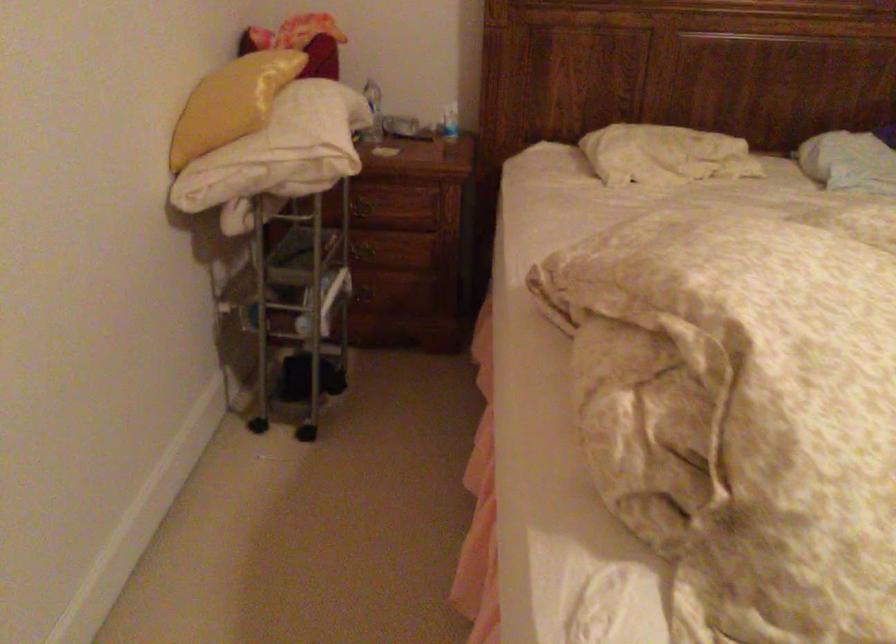
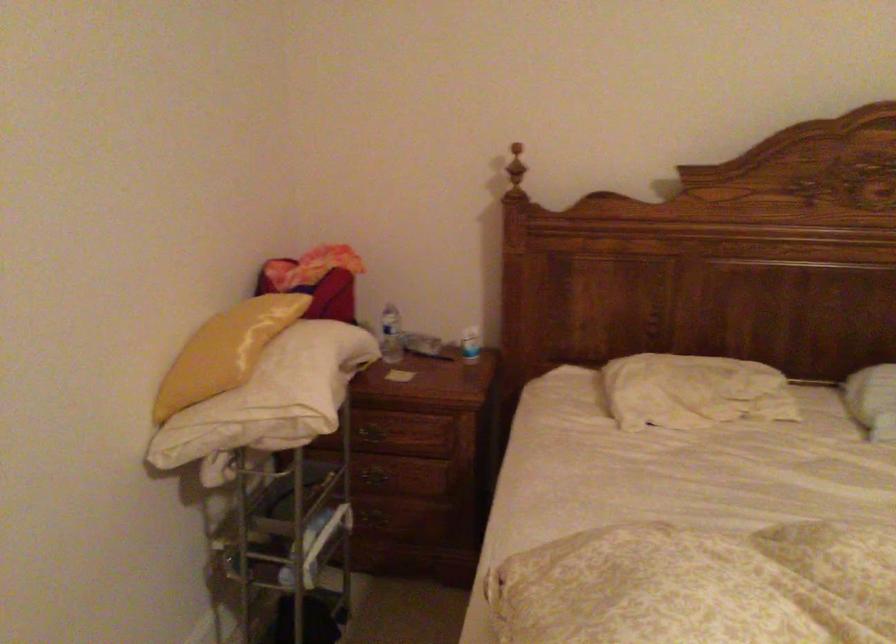
Locate, in the second image, the point that corresponds to point 453,122 in the first image.

(470, 344)